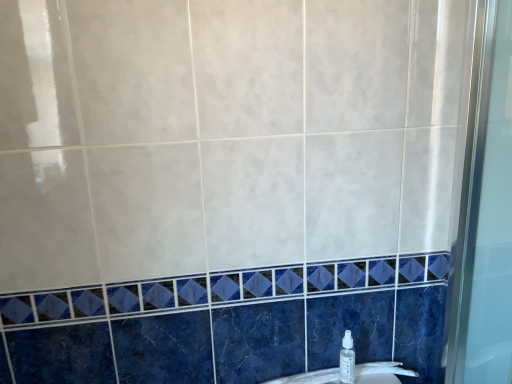
This screenshot has height=384, width=512. What do you see at coordinates (381, 372) in the screenshot?
I see `white glossy sink at lower center` at bounding box center [381, 372].

Locate an element on the screen. This screenshot has width=512, height=384. white glossy sink at lower center is located at coordinates (381, 372).

Measure the distance between clear plastic spray bottle at lower right and camera.

They are 3.60 feet apart.

Locate an element on the screen. The width and height of the screenshot is (512, 384). clear plastic spray bottle at lower right is located at coordinates (347, 359).

The image size is (512, 384). Describe the element at coordinates (347, 359) in the screenshot. I see `clear plastic spray bottle at lower right` at that location.

I want to click on white glossy sink at lower center, so click(381, 372).

Based on their positions, is clear plastic spray bottle at lower right located to the left or right of white glossy sink at lower center?

From the image, it's evident that clear plastic spray bottle at lower right is to the right of white glossy sink at lower center.

Consider the image. Which is behind, clear plastic spray bottle at lower right or white glossy sink at lower center?

white glossy sink at lower center is further from the camera.

Between point (349, 381) and point (396, 380), which one is positioned behind?

The point (396, 380) is more distant.

From the image's perspective, which is above, clear plastic spray bottle at lower right or white glossy sink at lower center?

From the image's view, clear plastic spray bottle at lower right is above.

From a real-world perspective, between clear plastic spray bottle at lower right and white glossy sink at lower center, who is vertically lower?

white glossy sink at lower center, from a real-world perspective.

Can you confirm if clear plastic spray bottle at lower right is thinner than white glossy sink at lower center?

In fact, clear plastic spray bottle at lower right might be wider than white glossy sink at lower center.

Which of these two, clear plastic spray bottle at lower right or white glossy sink at lower center, stands shorter?

With less height is white glossy sink at lower center.

Looking at this image, between clear plastic spray bottle at lower right and white glossy sink at lower center, which one has smaller size?

With smaller size is clear plastic spray bottle at lower right.

Is white glossy sink at lower center completely or partially inside clear plastic spray bottle at lower right?

No, white glossy sink at lower center is not inside clear plastic spray bottle at lower right.

Is clear plastic spray bottle at lower right in contact with white glossy sink at lower center?

Indeed, clear plastic spray bottle at lower right and white glossy sink at lower center are beside each other and touching.

Is white glossy sink at lower center at the back of clear plastic spray bottle at lower right?

No.

This screenshot has width=512, height=384. What are the coordinates of `sink beneath the clear plastic spray bottle at lower right (from a real-world perspective)` in the screenshot? It's located at (381, 372).

Does white glossy sink at lower center appear on the left side of clear plastic spray bottle at lower right?

Indeed, white glossy sink at lower center is positioned on the left side of clear plastic spray bottle at lower right.

Is white glossy sink at lower center behind clear plastic spray bottle at lower right?

That is True.

Considering the points (360, 364) and (349, 364), which point is behind, point (360, 364) or point (349, 364)?

The point (360, 364) is farther from the camera.

From the image's perspective, is white glossy sink at lower center on clear plastic spray bottle at lower right?

No, from the image's perspective, white glossy sink at lower center is not on top of clear plastic spray bottle at lower right.

From a real-world perspective, is white glossy sink at lower center on clear plastic spray bottle at lower right?

No, from a real-world perspective, white glossy sink at lower center is not over clear plastic spray bottle at lower right

Is white glossy sink at lower center wider than clear plastic spray bottle at lower right?

No.

Does white glossy sink at lower center have a lesser height compared to clear plastic spray bottle at lower right?

Yes.

In the scene shown: Considering the relative sizes of white glossy sink at lower center and clear plastic spray bottle at lower right in the image provided, is white glossy sink at lower center bigger than clear plastic spray bottle at lower right?

Indeed, white glossy sink at lower center has a larger size compared to clear plastic spray bottle at lower right.

Would you say white glossy sink at lower center is inside or outside clear plastic spray bottle at lower right?

white glossy sink at lower center lies outside clear plastic spray bottle at lower right.

Is there a large distance between white glossy sink at lower center and clear plastic spray bottle at lower right?

They are positioned close to each other.

Could you tell me if white glossy sink at lower center is turned towards clear plastic spray bottle at lower right?

No, white glossy sink at lower center is not turned towards clear plastic spray bottle at lower right.

How different are the orientations of white glossy sink at lower center and clear plastic spray bottle at lower right in degrees?

white glossy sink at lower center and clear plastic spray bottle at lower right are facing 0.00108 degrees away from each other.

How distant is white glossy sink at lower center from clear plastic spray bottle at lower right?

white glossy sink at lower center is 3.49 inches away from clear plastic spray bottle at lower right.

Where is `sink that appears below the clear plastic spray bottle at lower right (from the image's perspective)`? sink that appears below the clear plastic spray bottle at lower right (from the image's perspective) is located at coordinates (381, 372).

You are a GUI agent. You are given a task and a screenshot of the screen. Output one action in this format:
    pyautogui.click(x=<x>, y=<y>)
    Task: Click on the sink that is below the clear plastic spray bottle at lower right (from the image's perspective)
    
    Given the screenshot: What is the action you would take?
    pyautogui.click(x=381, y=372)

This screenshot has height=384, width=512. I want to click on sink located underneath the clear plastic spray bottle at lower right (from a real-world perspective), so click(x=381, y=372).